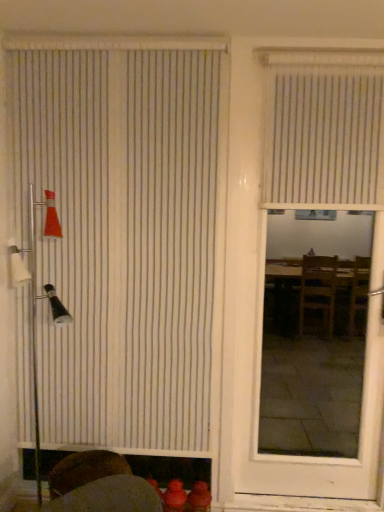
What is the approximate width of white vertical blinds at upper right, arranged as the first window blind when viewed from the right?

It is 12.11 centimeters.

The width and height of the screenshot is (384, 512). What are the coordinates of `white vertical blinds at upper right, arranged as the first window blind when viewed from the right` in the screenshot? It's located at (324, 130).

This screenshot has height=512, width=384. What are the coordinates of `white matte door at center` in the screenshot? It's located at (261, 338).

Is white matte door at center facing towards white vertical blinds at left, the 2th window blind positioned from the right?

No, white matte door at center is not turned towards white vertical blinds at left, the 2th window blind positioned from the right.

Is white matte door at center next to white vertical blinds at left, the 2th window blind positioned from the right, and touching it?

They are not placed beside each other.

From a real-world perspective, between white matte door at center and white vertical blinds at left, the 2th window blind positioned from the right, who is vertically higher?

white vertical blinds at left, the 2th window blind positioned from the right, is physically above.

Which of these two, white matte door at center or white vertical blinds at left, which ranks as the first window blind in left-to-right order, stands taller?

With more height is white vertical blinds at left, which ranks as the first window blind in left-to-right order.

Who is bigger, white vertical blinds at upper right, arranged as the first window blind when viewed from the right, or white matte door at center?

With larger size is white matte door at center.

How many degrees apart are the facing directions of white vertical blinds at upper right, the 2th window blind positioned from the left, and white matte door at center?

9.8e-05 degrees separate the facing orientations of white vertical blinds at upper right, the 2th window blind positioned from the left, and white matte door at center.

Is white vertical blinds at upper right, the 2th window blind positioned from the left, shorter than white matte door at center?

Yes.

Based on the photo, looking at their sizes, would you say white vertical blinds at left, the 2th window blind positioned from the right, is wider or thinner than white matte door at center?

Clearly, white vertical blinds at left, the 2th window blind positioned from the right, has less width compared to white matte door at center.

From a real-world perspective, is white vertical blinds at left, the 2th window blind positioned from the right, on top of white matte door at center?

Yes, from a real-world perspective, white vertical blinds at left, the 2th window blind positioned from the right, is over white matte door at center

In the image, is white matte door at center positioned in front of or behind white vertical blinds at upper right, arranged as the first window blind when viewed from the right?

Visually, white matte door at center is located in front of white vertical blinds at upper right, arranged as the first window blind when viewed from the right.

Is white matte door at center oriented towards white vertical blinds at upper right, the 2th window blind positioned from the left?

Yes, white matte door at center faces towards white vertical blinds at upper right, the 2th window blind positioned from the left.

Is white vertical blinds at upper right, arranged as the first window blind when viewed from the right, inside white matte door at center?

Yes, white vertical blinds at upper right, arranged as the first window blind when viewed from the right, can be found within white matte door at center.

From the image's perspective, between white matte door at center and white vertical blinds at upper right, arranged as the first window blind when viewed from the right, who is located below?

white matte door at center, from the image's perspective.

Between white vertical blinds at upper right, arranged as the first window blind when viewed from the right, and white vertical blinds at left, the 2th window blind positioned from the right, which one is positioned behind?

white vertical blinds at left, the 2th window blind positioned from the right, is further from the camera.

Who is shorter, white vertical blinds at upper right, arranged as the first window blind when viewed from the right, or white vertical blinds at left, the 2th window blind positioned from the right?

Standing shorter between the two is white vertical blinds at upper right, arranged as the first window blind when viewed from the right.

Does white vertical blinds at upper right, the 2th window blind positioned from the left, have a greater width compared to white vertical blinds at left, which ranks as the first window blind in left-to-right order?

Indeed, white vertical blinds at upper right, the 2th window blind positioned from the left, has a greater width compared to white vertical blinds at left, which ranks as the first window blind in left-to-right order.

From the picture: Between white vertical blinds at upper right, arranged as the first window blind when viewed from the right, and white vertical blinds at left, the 2th window blind positioned from the right, which one has larger size?

Bigger between the two is white vertical blinds at left, the 2th window blind positioned from the right.

Is white vertical blinds at left, the 2th window blind positioned from the right, completely or partially outside of white vertical blinds at upper right, the 2th window blind positioned from the left?

white vertical blinds at left, the 2th window blind positioned from the right, lies outside white vertical blinds at upper right, the 2th window blind positioned from the left,'s area.

Identify the location of window blind behind the white vertical blinds at upper right, arranged as the first window blind when viewed from the right. This screenshot has height=512, width=384. (125, 239).

Between white vertical blinds at left, which ranks as the first window blind in left-to-right order, and white vertical blinds at upper right, arranged as the first window blind when viewed from the right, which one has smaller width?

white vertical blinds at left, which ranks as the first window blind in left-to-right order.

Where is `the 1st window blind directly above the white matte door at center (from a real-world perspective)`? the 1st window blind directly above the white matte door at center (from a real-world perspective) is located at coordinates (125, 239).

The width and height of the screenshot is (384, 512). Identify the location of door beneath the white vertical blinds at upper right, arranged as the first window blind when viewed from the right (from a real-world perspective). (261, 338).

Looking at the image, which one is located closer to white matte door at center, white vertical blinds at upper right, the 2th window blind positioned from the left, or white vertical blinds at left, the 2th window blind positioned from the right?

white vertical blinds at upper right, the 2th window blind positioned from the left, is positioned closer to the anchor white matte door at center.

Which object lies nearer to the anchor point white matte door at center, white vertical blinds at left, the 2th window blind positioned from the right, or white vertical blinds at upper right, arranged as the first window blind when viewed from the right?

white vertical blinds at upper right, arranged as the first window blind when viewed from the right, lies closer to white matte door at center than the other object.

From the image, which object appears to be nearer to white vertical blinds at left, which ranks as the first window blind in left-to-right order, white vertical blinds at upper right, the 2th window blind positioned from the left, or white matte door at center?

white matte door at center lies closer to white vertical blinds at left, which ranks as the first window blind in left-to-right order, than the other object.

From the image, which object appears to be farther from white vertical blinds at upper right, the 2th window blind positioned from the left, white vertical blinds at left, the 2th window blind positioned from the right, or white matte door at center?

white vertical blinds at left, the 2th window blind positioned from the right, is positioned further to the anchor white vertical blinds at upper right, the 2th window blind positioned from the left.

Based on the photo, when comparing their distances from white vertical blinds at left, the 2th window blind positioned from the right, does white matte door at center or white vertical blinds at upper right, arranged as the first window blind when viewed from the right, seem further?

The object further to white vertical blinds at left, the 2th window blind positioned from the right, is white vertical blinds at upper right, arranged as the first window blind when viewed from the right.

Looking at the image, which one is located further to white vertical blinds at upper right, arranged as the first window blind when viewed from the right, white matte door at center or white vertical blinds at left, which ranks as the first window blind in left-to-right order?

white vertical blinds at left, which ranks as the first window blind in left-to-right order, is further to white vertical blinds at upper right, arranged as the first window blind when viewed from the right.

Find the location of `door situated between white vertical blinds at left, which ranks as the first window blind in left-to-right order, and white vertical blinds at upper right, arranged as the first window blind when viewed from the right, from left to right`. door situated between white vertical blinds at left, which ranks as the first window blind in left-to-right order, and white vertical blinds at upper right, arranged as the first window blind when viewed from the right, from left to right is located at coordinates (261, 338).